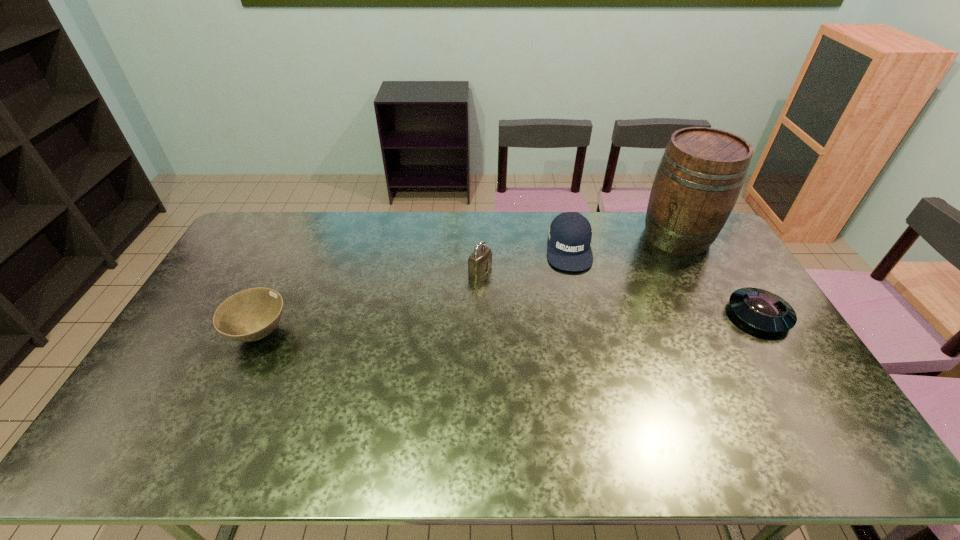
Where is `bowl`? Image resolution: width=960 pixels, height=540 pixels. bowl is located at coordinates (249, 315).

Image resolution: width=960 pixels, height=540 pixels. In order to click on the shortest object in this screenshot , I will do `click(761, 309)`.

At what (x,y) coordinates should I click in order to perform the action: click on padlock. Please return your answer as a coordinate pair (x, y). The height and width of the screenshot is (540, 960). Looking at the image, I should click on (480, 260).

Locate an element on the screen. This screenshot has width=960, height=540. the third object from right to left is located at coordinates (570, 233).

Find the location of `cider`. cider is located at coordinates (700, 176).

In order to click on free space located 0.200m on the back of the leftmost object in this screenshot , I will do `click(291, 268)`.

I want to click on vacant space located 0.310m on the left of the shortest object, so click(630, 315).

Locate an element on the screen. The height and width of the screenshot is (540, 960). free region located at the front of the padlock near the keyhole is located at coordinates (524, 294).

Where is `vacant space situated at the front of the padlock near the keyhole`? This screenshot has width=960, height=540. vacant space situated at the front of the padlock near the keyhole is located at coordinates (573, 319).

You are a GUI agent. You are given a task and a screenshot of the screen. Output one action in this format:
    pyautogui.click(x=<x>, y=<y>)
    Task: Click on the vacant region located at the front of the padlock near the keyhole
    
    Given the screenshot: What is the action you would take?
    pyautogui.click(x=527, y=295)